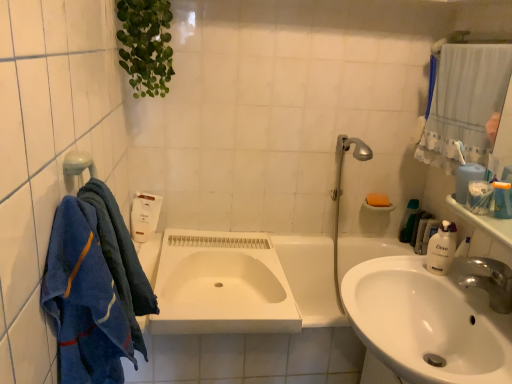
Question: Would you say white plastic soap dispenser at upper right, acting as the first toiletry starting from the right, is inside or outside white glossy countertop at upper right?

Choices:
 (A) outside
 (B) inside

Answer: (A)

Question: Would you say white plastic soap dispenser at upper right, which ranks as the second toiletry in front-to-back order, is to the left or to the right of white glossy countertop at upper right in the picture?

Choices:
 (A) right
 (B) left

Answer: (A)

Question: Considering the real-world distances, which object is closest to the white glossy sink at lower right, which is the second sink from back to front?

Choices:
 (A) silver metallic showerhead at upper right
 (B) blue terry cloth towel at left, the second bath towel when ordered from front to back
 (C) white plastic soap dispenser at upper right, which ranks as the second toiletry in front-to-back order
 (D) green plastic bottle at right, which is counted as the second toiletry, starting from the right
 (E) white textured mirror at upper right

Answer: (E)

Question: Estimate the real-world distances between objects in this image. Which object is closer to the white glossy soap dispenser at right?

Choices:
 (A) green leafy plant at upper left
 (B) white plastic soap dispenser at upper right, acting as the first toiletry starting from the right
 (C) white glossy sink at lower right, which is the second sink from back to front
 (D) green plastic bottle at right, acting as the second toiletry starting from the left
 (E) silver metallic faucet at sink right

Answer: (E)